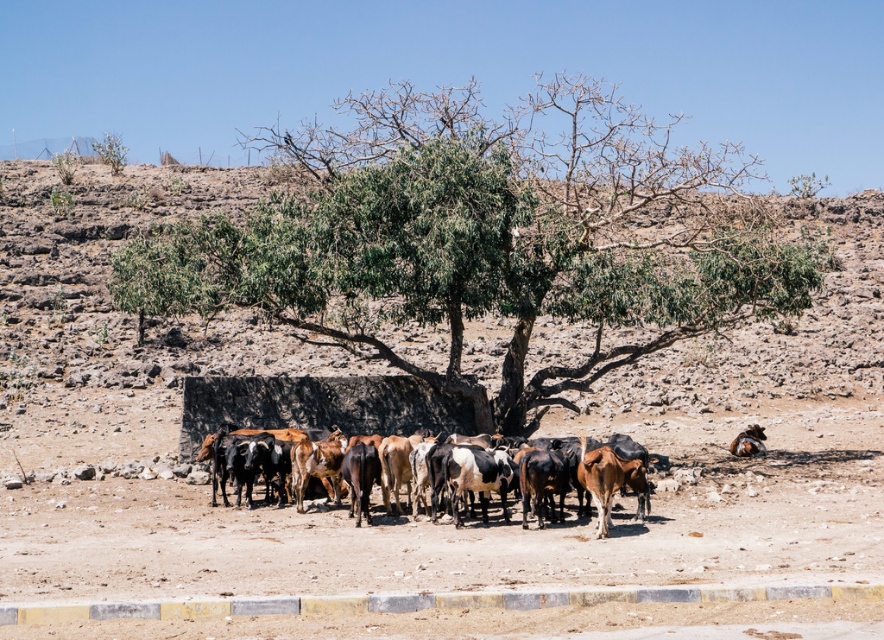
Question: Can you confirm if dull brown dirt field at center is smaller than brown/cracked earth cows at center?

Choices:
 (A) yes
 (B) no

Answer: (B)

Question: Among these points, which one is nearest to the camera?

Choices:
 (A) (246, 500)
 (B) (170, 195)
 (C) (178, 232)

Answer: (A)

Question: Does dull brown dirt field at center have a greater width compared to brown/cracked earth cows at center?

Choices:
 (A) no
 (B) yes

Answer: (B)

Question: Estimate the real-world distances between objects in this image. Which object is closer to the green leafy tree at center?

Choices:
 (A) dull brown dirt field at center
 (B) brown/cracked earth cows at center

Answer: (A)

Question: Can you confirm if dull brown dirt field at center is smaller than green leafy tree at center?

Choices:
 (A) yes
 (B) no

Answer: (A)

Question: Which object is the farthest from the dull brown dirt field at center?

Choices:
 (A) green leafy tree at center
 (B) brown/cracked earth cows at center

Answer: (B)